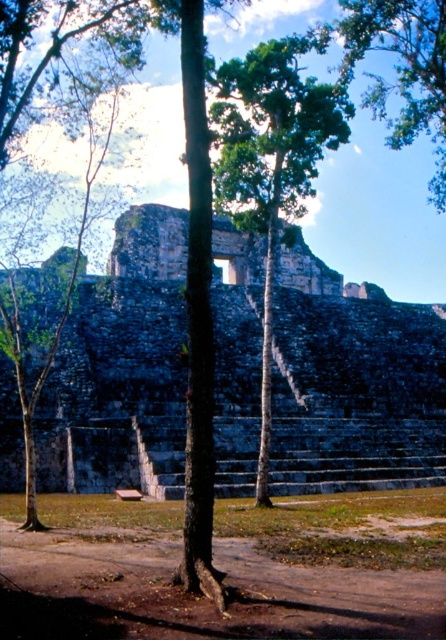
You are standing in front of an ancient stone structure and see a point marked at coordinates (354, 387). Based on the scene description, what does this point most likely represent?

The point at (354, 387) most likely represents the gray stone amphitheater at center as described in the scene.

You are an archaeologist standing at the base of the ancient stone structure. You notice the gray stone amphitheater at center and the green leafy tree at center. Which structure is taller?

The gray stone amphitheater at center has a lesser height compared to green leafy tree at center, so the green leafy tree at center is taller.